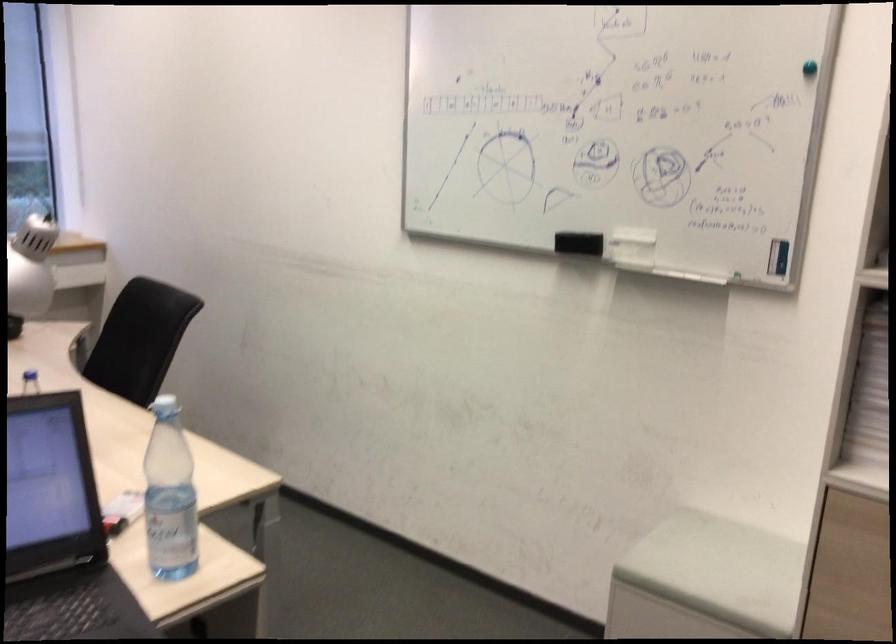
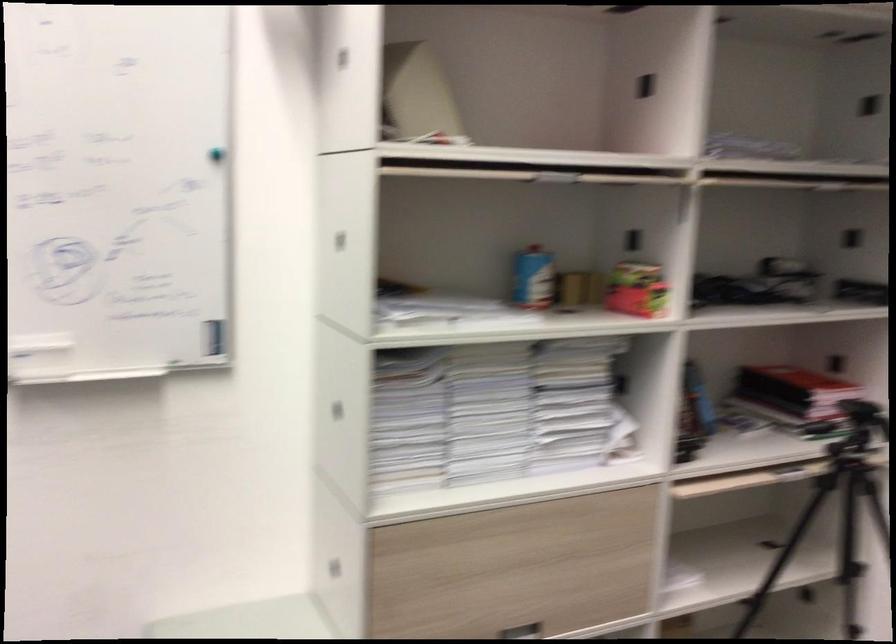
Locate, in the second image, the point that corresponds to point 658,176 in the first image.

(64, 270)